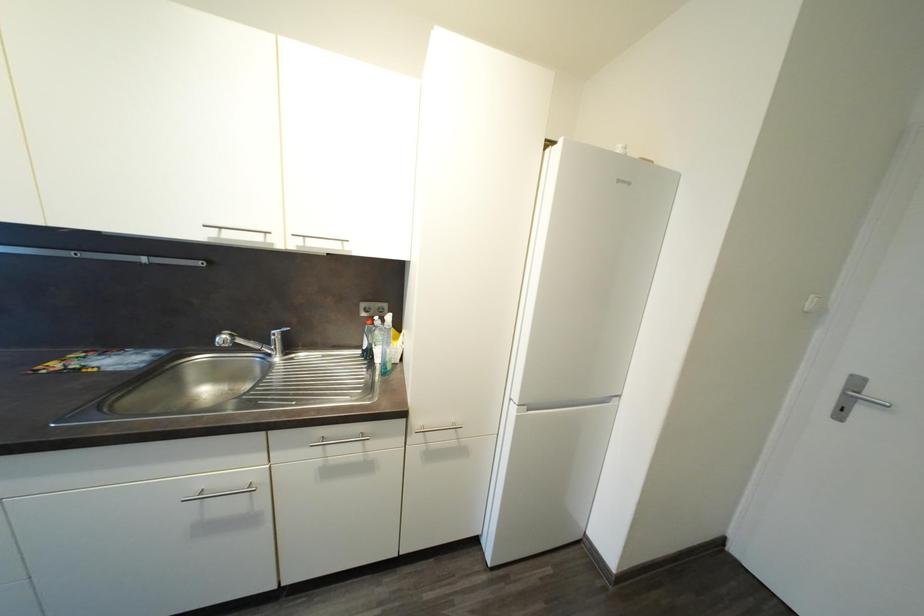
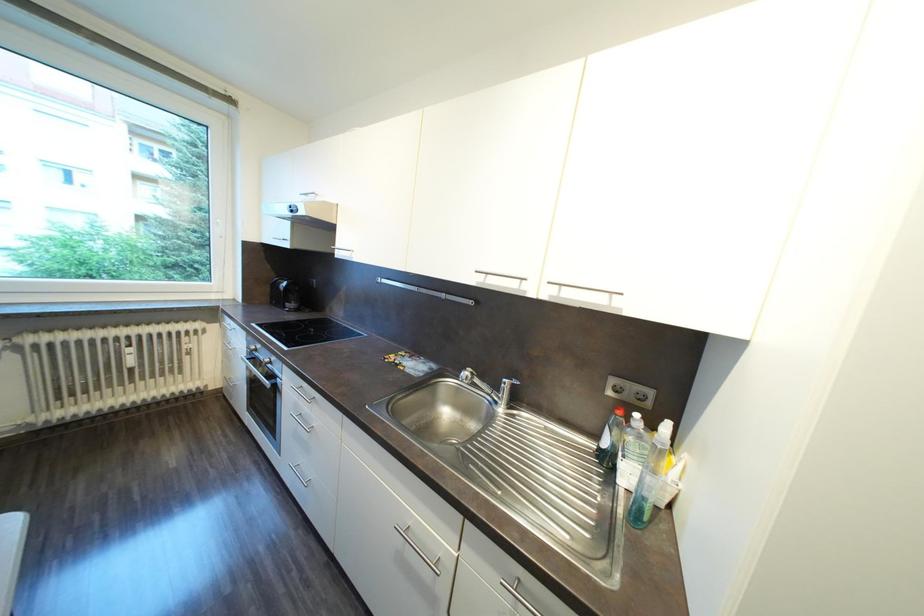
Question: The first image is from the beginning of the video and the second image is from the end. How did the camera likely rotate when shooting the video?

Choices:
 (A) Left
 (B) Right
 (C) Up
 (D) Down

Answer: (A)